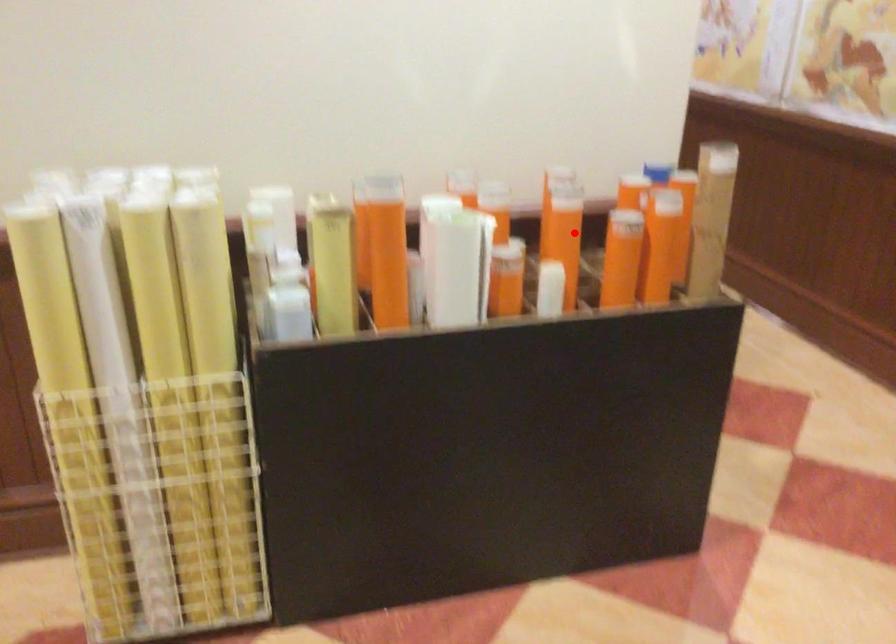
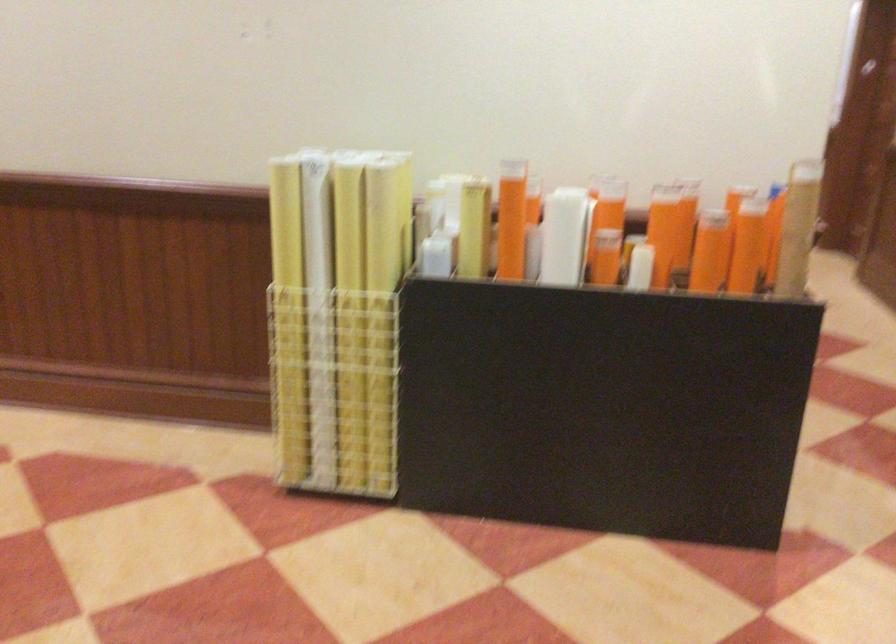
Question: I am providing you with two images of the same scene from different viewpoints. Given a red point in image1, look at the same physical point in image2. Is it:

Choices:
 (A) Closer to the viewpoint
 (B) Farther from the viewpoint

Answer: (B)